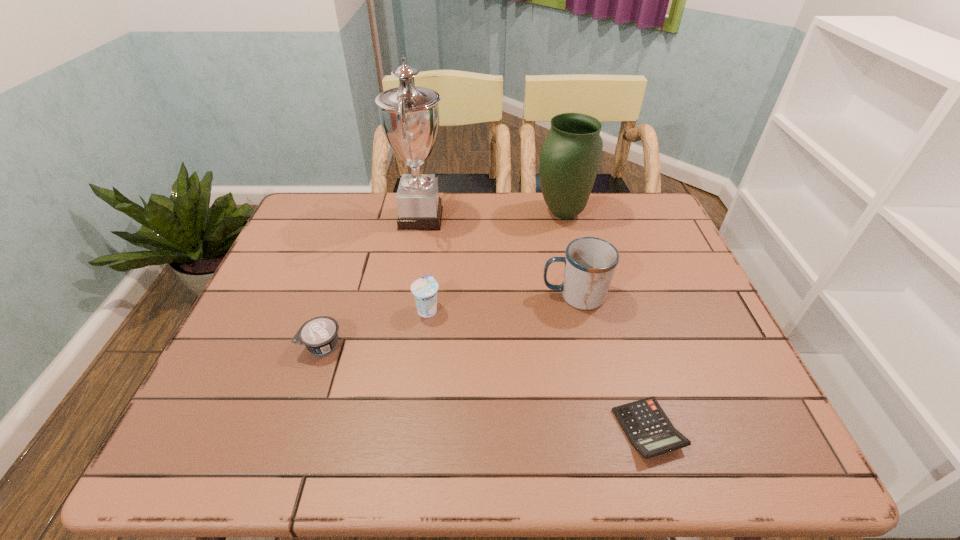
Where is `the tallest object`? The height and width of the screenshot is (540, 960). the tallest object is located at coordinates (409, 115).

Where is `vase`? vase is located at coordinates (570, 157).

The image size is (960, 540). I want to click on the fourth shortest object, so click(590, 262).

Where is `the farther yogurt`? the farther yogurt is located at coordinates (424, 289).

At what (x,y) coordinates should I click in order to perform the action: click on the taller yogurt. Please return your answer as a coordinate pair (x, y). Looking at the image, I should click on (424, 289).

This screenshot has height=540, width=960. Find the location of `the second nearest object`. the second nearest object is located at coordinates (319, 335).

Identify the location of the second shortest object. (319, 335).

Where is `calculator`? The height and width of the screenshot is (540, 960). calculator is located at coordinates (647, 427).

Locate an element on the screen. This screenshot has height=540, width=960. the shortest object is located at coordinates (647, 427).

What are the coordinates of `vacant space located 0.160m at the front view of the tallest object` in the screenshot? It's located at (498, 218).